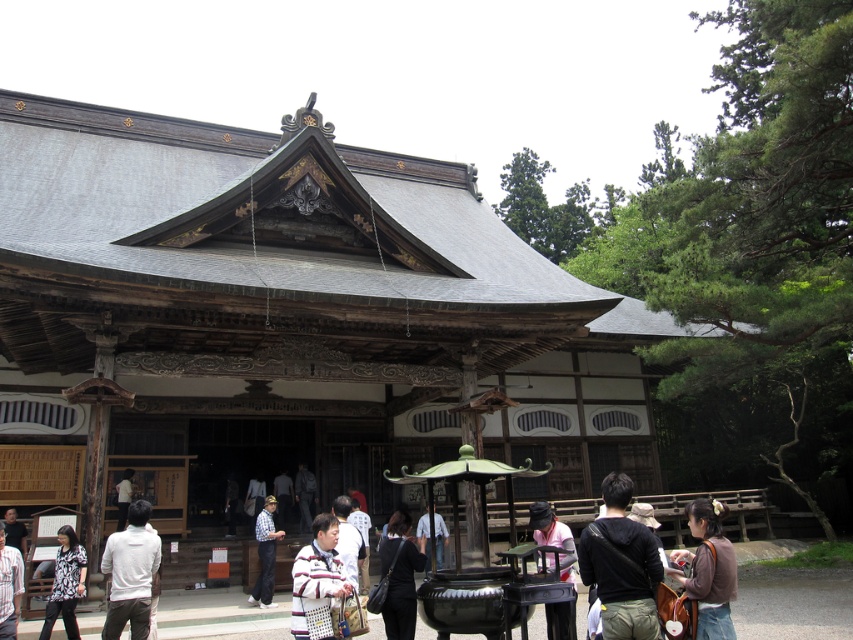
Question: Which of these objects is positioned closest to the brown fabric bag at lower right?

Choices:
 (A) striped sweater at center
 (B) checkered fabric shirt at center
 (C) pink fabric at center
 (D) white cotton shirt at lower left

Answer: (C)

Question: Is white matte shirt at center to the left of striped sweater at center from the viewer's perspective?

Choices:
 (A) no
 (B) yes

Answer: (B)

Question: Does black fabric bag at center lie in front of checkered fabric shirt at center?

Choices:
 (A) no
 (B) yes

Answer: (B)

Question: Is black fabric bag at center smaller than matte black shirt at center?

Choices:
 (A) yes
 (B) no

Answer: (A)

Question: Estimate the real-world distances between objects in this image. Which object is closer to the white matte shirt at center?

Choices:
 (A) white cotton shirt at lower left
 (B) striped sweater at center

Answer: (A)

Question: Which point is farther to the camera?

Choices:
 (A) brown fabric bag at lower right
 (B) checkered fabric shirt at center

Answer: (B)